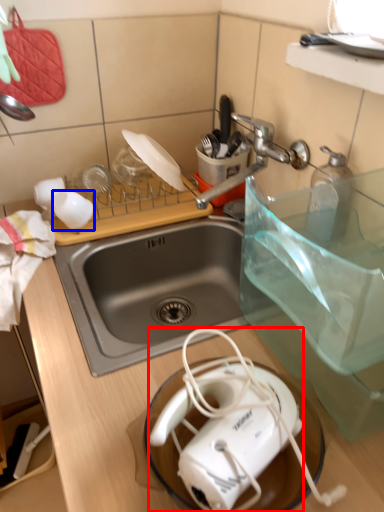
Question: Among these objects, which one is nearest to the camera, toaster (highlighted by a red box) or coffee cup (highlighted by a blue box)?

Choices:
 (A) toaster
 (B) coffee cup

Answer: (A)